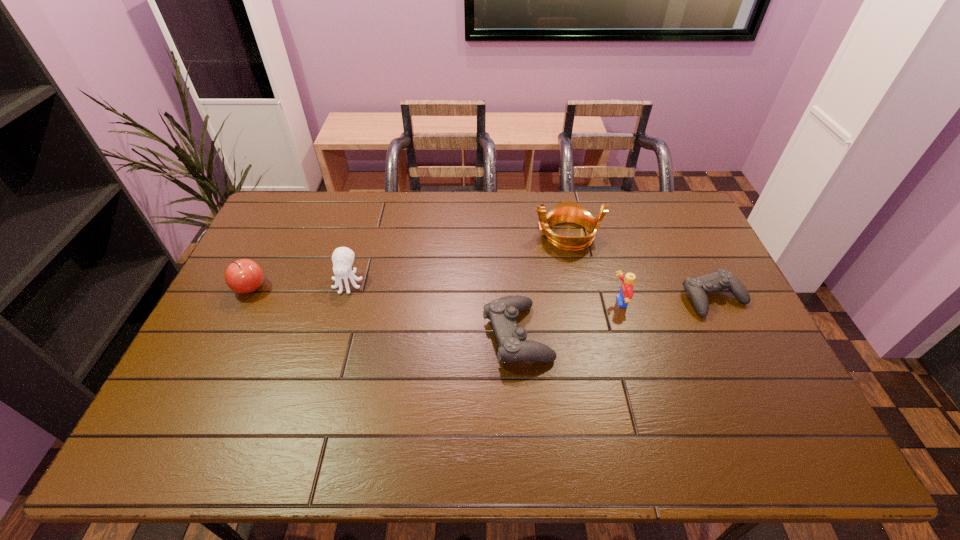
All controls are currently evenly spaced. To continue this pattern, where would you add another control on the left? Please point out a vacant spot. Please provide its 2D coordinates. Your answer should be formatted as a tuple, i.e. [(x, y)], where the tuple contains the x and y coordinates of a point satisfying the conditions above.

[(289, 377)]